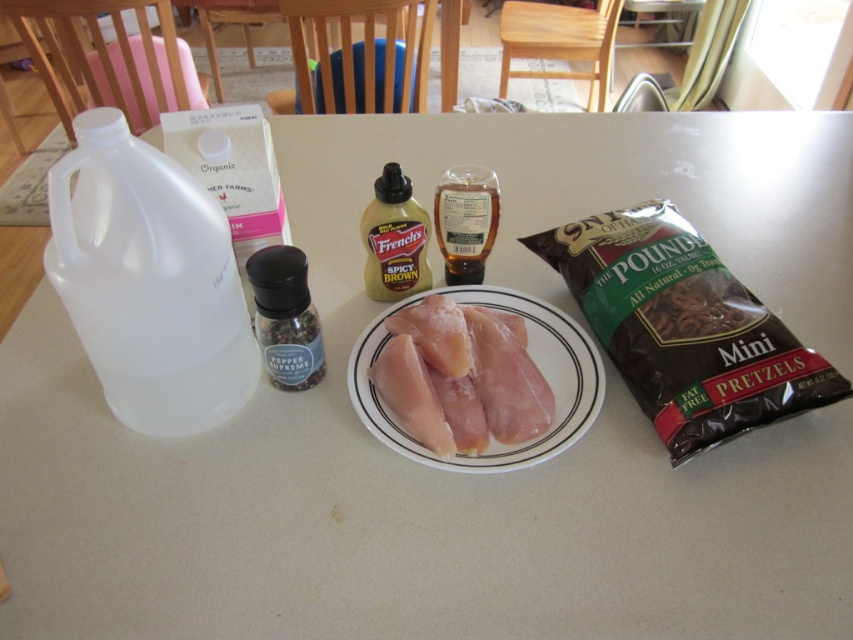
Question: Among these objects, which one is nearest to the camera?

Choices:
 (A) black matte pepper shaker at center-left
 (B) translucent plastic bottle of french's spicy brown mustard at center

Answer: (A)

Question: Can you confirm if brown paper bag of pretzels at right is thinner than black matte pepper shaker at center-left?

Choices:
 (A) yes
 (B) no

Answer: (B)

Question: Estimate the real-world distances between objects in this image. Which object is farther from the translucent plastic bottle at center?

Choices:
 (A) black matte pepper shaker at center-left
 (B) brown paper bag of pretzels at right

Answer: (A)

Question: Can you confirm if white ceramic plate at center is positioned above black matte pepper shaker at center-left?

Choices:
 (A) no
 (B) yes

Answer: (A)

Question: Can you confirm if white ceramic plate at center is positioned to the right of translucent plastic bottle of french's spicy brown mustard at center?

Choices:
 (A) no
 (B) yes

Answer: (B)

Question: Which of the following is the closest to the observer?

Choices:
 (A) (788, 394)
 (B) (292, 284)

Answer: (B)